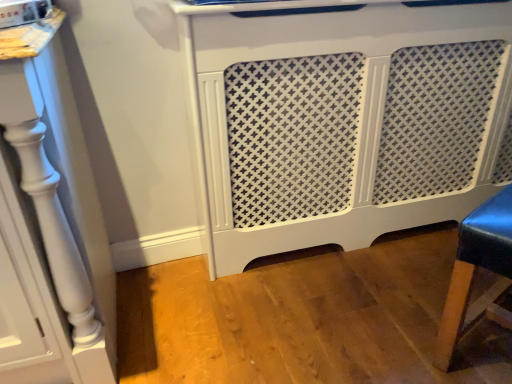
Find the location of a particular element. space that is in front of white plastic radiator at center is located at coordinates (374, 297).